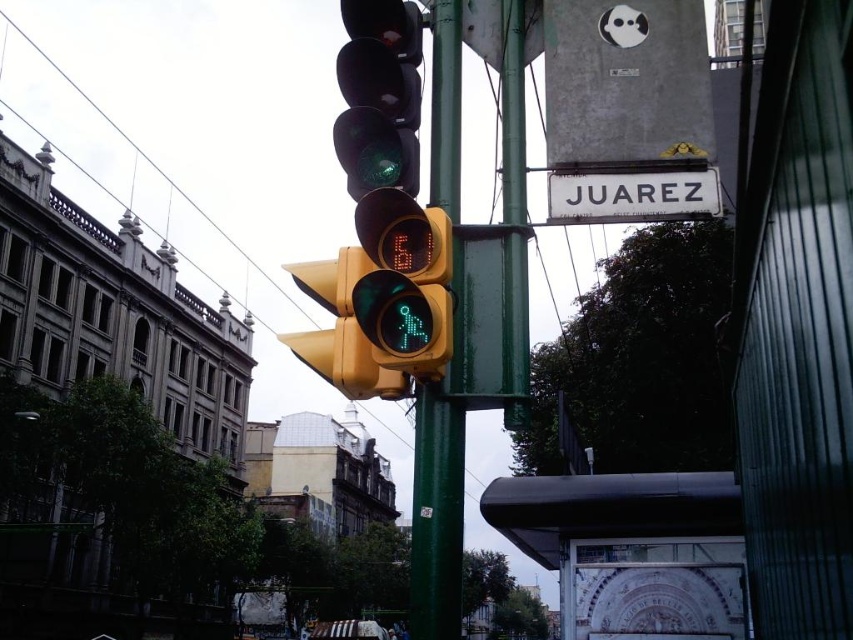
Question: Can you confirm if green metallic pole at center is wider than yellow matte pedestrian signal at center?

Choices:
 (A) yes
 (B) no

Answer: (B)

Question: Which point is closer to the camera?

Choices:
 (A) yellow matte pedestrian signal at center
 (B) green metallic pole at center

Answer: (A)

Question: Among these objects, which one is farthest from the camera?

Choices:
 (A) green matte pedestrian signal at center
 (B) white plastic street sign at upper center
 (C) metallic wire at upper left

Answer: (C)

Question: Is green matte pedestrian signal at center bigger than yellow matte pedestrian signal at center?

Choices:
 (A) yes
 (B) no

Answer: (B)

Question: Does green matte pedestrian signal at center appear on the left side of white plastic street sign at upper center?

Choices:
 (A) no
 (B) yes

Answer: (B)

Question: Among these objects, which one is nearest to the camera?

Choices:
 (A) metallic wire at upper left
 (B) white plastic street sign at upper center

Answer: (B)